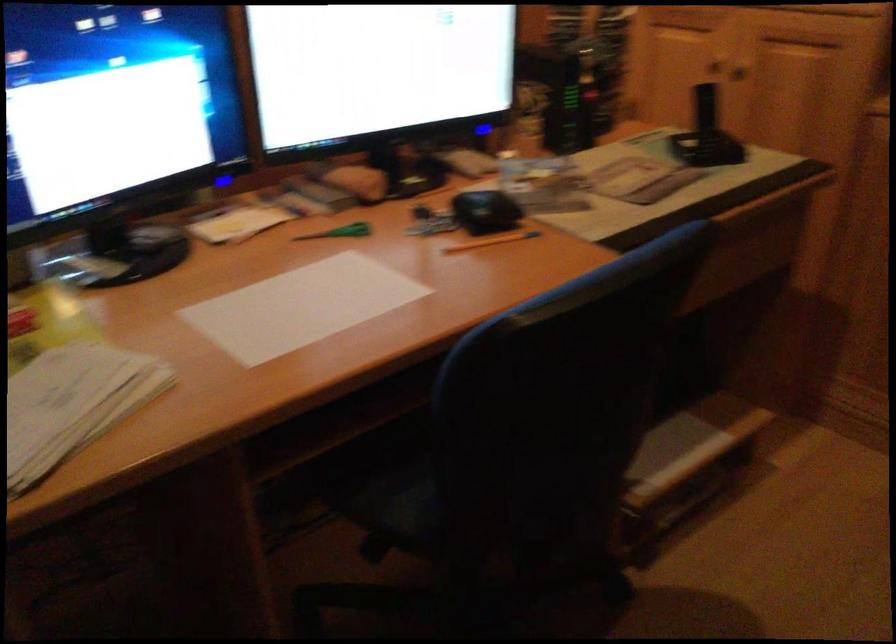
Image resolution: width=896 pixels, height=644 pixels. Describe the element at coordinates (734, 76) in the screenshot. I see `the cabinet door knob` at that location.